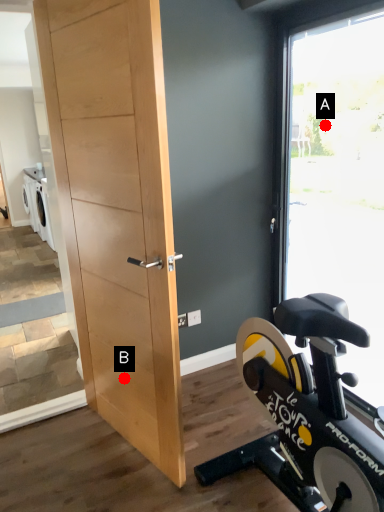
Question: Two points are circled on the image, labeled by A and B beside each circle. Which point is farther to the camera?

Choices:
 (A) A is further
 (B) B is further

Answer: (A)